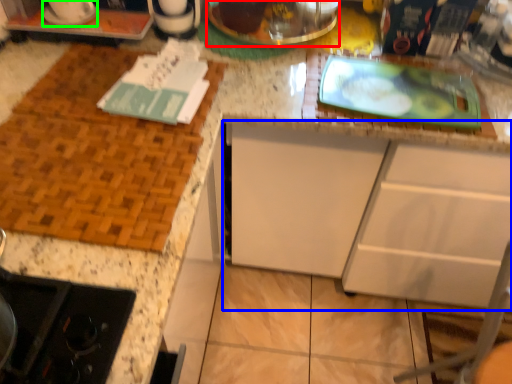
Question: Which is nearer to the appliance (highlighted by a red box)? cabinetry (highlighted by a blue box) or appliance (highlighted by a green box).

Choices:
 (A) cabinetry
 (B) appliance

Answer: (B)